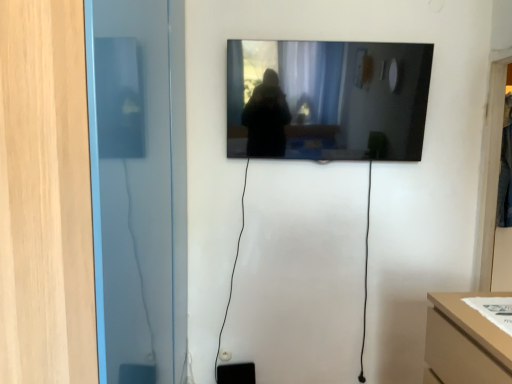
Question: Is transparent glass door at left, positioned as the 1th glass door in front-to-back order, in contact with black glossy mirror at upper center?

Choices:
 (A) yes
 (B) no

Answer: (B)

Question: Is transparent glass door at left, which is the first glass door in left-to-right order, positioned with its back to black glossy mirror at upper center?

Choices:
 (A) no
 (B) yes

Answer: (A)

Question: Is transparent glass door at left, which is the first glass door in left-to-right order, behind black glossy mirror at upper center?

Choices:
 (A) no
 (B) yes

Answer: (A)

Question: Is transparent glass door at left, which is the first glass door in left-to-right order, taller than black glossy mirror at upper center?

Choices:
 (A) no
 (B) yes

Answer: (B)

Question: Is transparent glass door at left, positioned as the 1th glass door in front-to-back order, closer to the viewer compared to black glossy mirror at upper center?

Choices:
 (A) no
 (B) yes

Answer: (B)

Question: In the image, is transparent glass door at right, the 2th glass door viewed from the left, on the left side or the right side of transparent glass door at left, which is the first glass door in left-to-right order?

Choices:
 (A) left
 (B) right

Answer: (B)

Question: From a real-world perspective, relative to transparent glass door at left, which is the first glass door in left-to-right order, is transparent glass door at right, which is counted as the second glass door, starting from the front, vertically above or below?

Choices:
 (A) above
 (B) below

Answer: (A)

Question: Is transparent glass door at right, the 2th glass door viewed from the left, inside the boundaries of transparent glass door at left, arranged as the second glass door when viewed from the right, or outside?

Choices:
 (A) inside
 (B) outside

Answer: (B)

Question: Considering their positions, is transparent glass door at right, the 2th glass door viewed from the left, located in front of or behind transparent glass door at left, which is the first glass door in left-to-right order?

Choices:
 (A) behind
 (B) front

Answer: (A)

Question: Is transparent glass door at right, which is counted as the second glass door, starting from the front, situated inside black glossy mirror at upper center or outside?

Choices:
 (A) outside
 (B) inside

Answer: (A)

Question: Visually, is transparent glass door at right, which is counted as the second glass door, starting from the front, positioned to the left or to the right of black glossy mirror at upper center?

Choices:
 (A) left
 (B) right

Answer: (B)

Question: From a real-world perspective, is transparent glass door at right, the 2th glass door viewed from the left, physically located above or below black glossy mirror at upper center?

Choices:
 (A) below
 (B) above

Answer: (A)

Question: From the image's perspective, is transparent glass door at right, acting as the first glass door starting from the back, located above or below black glossy mirror at upper center?

Choices:
 (A) below
 (B) above

Answer: (A)

Question: Is transparent glass door at left, positioned as the 1th glass door in front-to-back order, taller or shorter than transparent glass door at right, acting as the first glass door starting from the back?

Choices:
 (A) short
 (B) tall

Answer: (B)

Question: Considering the positions of transparent glass door at left, which is the first glass door in left-to-right order, and transparent glass door at right, which is counted as the second glass door, starting from the front, in the image, is transparent glass door at left, which is the first glass door in left-to-right order, wider or thinner than transparent glass door at right, which is counted as the second glass door, starting from the front,?

Choices:
 (A) thin
 (B) wide

Answer: (B)